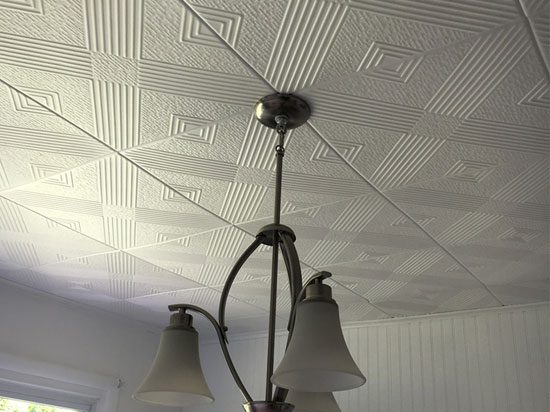
The image size is (550, 412). In order to click on light shade in this screenshot , I will do `click(302, 347)`, `click(182, 363)`, `click(312, 398)`.